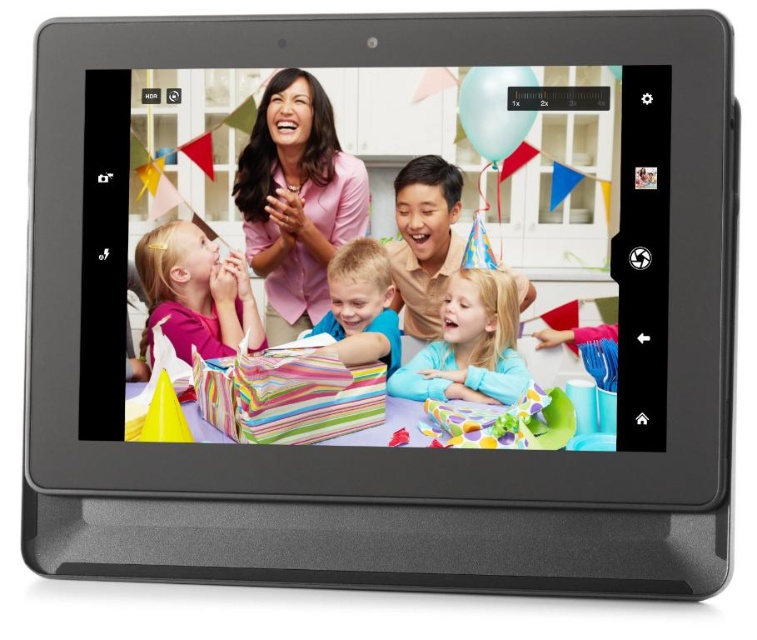
You are looking at the tablet screen and see the pink matte shirt at center and the pastel blue fabric at center. Which one appears closer to you on the screen?

The pink matte shirt at center appears closer to you than the pastel blue fabric at center because it is positioned further to the viewer in the image.

Based on the photo, you are holding a tablet showing a birthday party scene. You see a pink matte shirt at center and a pastel blue fabric at center. If you want to touch both items on the tablet screen with your finger, will your finger need to move horizontally or vertically?

The pink matte shirt at center is 11.01 inches away from pastel blue fabric at center. Since the distance is measured in inches, it indicates a horizontal or vertical movement. However, without knowing the direction, we can only confirm that your finger will need to move either horizontally or vertically to reach both items on the tablet screen.

You are a guest at the birthday party looking at the tablet. You see the pastel blue fabric at center and the smooth blonde hair at center. Which one is more to the right?

The pastel blue fabric at center is more to the right because it is positioned on the right side of smooth blonde hair at center.